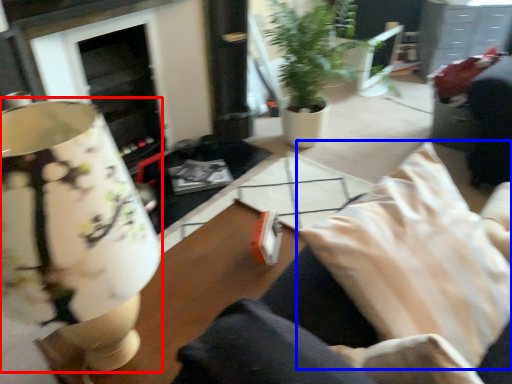
Question: Which of the following is the farthest to the observer, table lamp (highlighted by a red box) or pillow (highlighted by a blue box)?

Choices:
 (A) table lamp
 (B) pillow

Answer: (B)